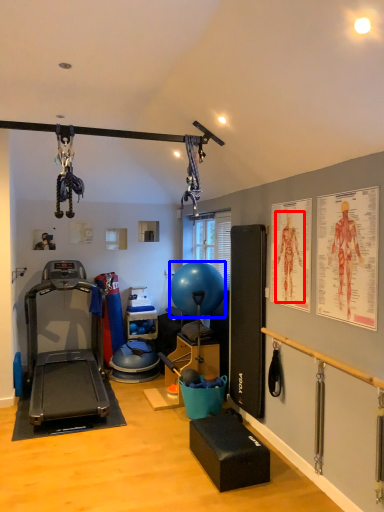
Question: Which object is further to the camera taking this photo, person (highlighted by a red box) or balloon (highlighted by a blue box)?

Choices:
 (A) person
 (B) balloon

Answer: (B)